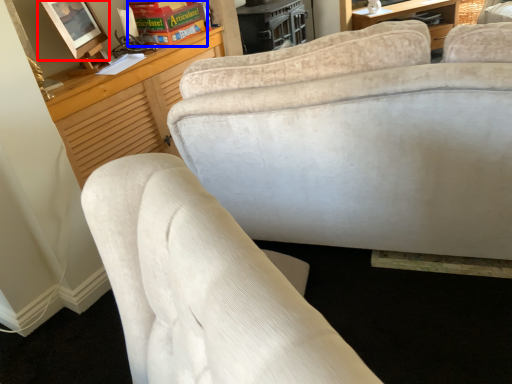
Question: Among these objects, which one is farthest to the camera, picture frame (highlighted by a red box) or book (highlighted by a blue box)?

Choices:
 (A) picture frame
 (B) book

Answer: (B)